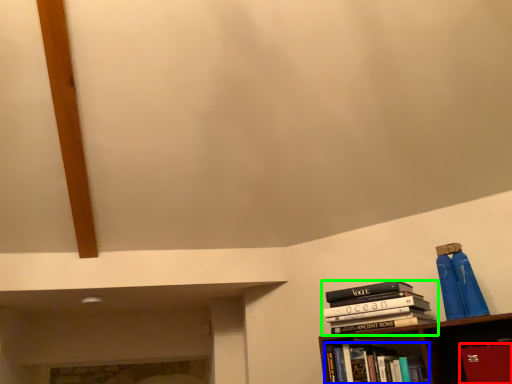
Question: Based on their relative distances, which object is farther from paperback book (highlighted by a red box)? Choose from book (highlighted by a blue box) and book (highlighted by a green box).

Choices:
 (A) book
 (B) book

Answer: (A)